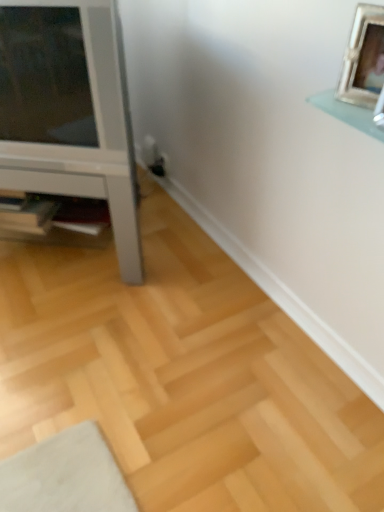
Question: Is the surface of wooden shelf at lower left in direct contact with silver metallic picture frame at upper right?

Choices:
 (A) no
 (B) yes

Answer: (A)

Question: Is wooden shelf at lower left turned away from silver metallic picture frame at upper right?

Choices:
 (A) yes
 (B) no

Answer: (B)

Question: Considering the relative sizes of wooden shelf at lower left and silver metallic picture frame at upper right in the image provided, is wooden shelf at lower left bigger than silver metallic picture frame at upper right?

Choices:
 (A) no
 (B) yes

Answer: (B)

Question: Can you confirm if wooden shelf at lower left is shorter than silver metallic picture frame at upper right?

Choices:
 (A) no
 (B) yes

Answer: (B)

Question: From the image's perspective, is wooden shelf at lower left above silver metallic picture frame at upper right?

Choices:
 (A) no
 (B) yes

Answer: (A)

Question: In terms of height, does wooden shelf at lower left look taller or shorter compared to silver metallic picture frame at upper right?

Choices:
 (A) tall
 (B) short

Answer: (B)

Question: Looking at the image, does wooden shelf at lower left seem bigger or smaller compared to silver metallic picture frame at upper right?

Choices:
 (A) small
 (B) big

Answer: (B)

Question: Considering the relative positions of wooden shelf at lower left and silver metallic picture frame at upper right in the image provided, is wooden shelf at lower left to the left or to the right of silver metallic picture frame at upper right?

Choices:
 (A) right
 (B) left

Answer: (B)

Question: Choose the correct answer: Is wooden shelf at lower left inside silver metallic picture frame at upper right or outside it?

Choices:
 (A) inside
 (B) outside

Answer: (B)

Question: Is white glossy tv stand at left taller or shorter than wooden shelf at lower left?

Choices:
 (A) short
 (B) tall

Answer: (B)

Question: Considering their positions, is white glossy tv stand at left located in front of or behind wooden shelf at lower left?

Choices:
 (A) behind
 (B) front

Answer: (B)

Question: From the image's perspective, is white glossy tv stand at left positioned above or below wooden shelf at lower left?

Choices:
 (A) above
 (B) below

Answer: (A)

Question: From a real-world perspective, is white glossy tv stand at left positioned above or below wooden shelf at lower left?

Choices:
 (A) below
 (B) above

Answer: (B)

Question: Would you say wooden shelf at lower left is inside or outside white glossy tv stand at left?

Choices:
 (A) outside
 (B) inside

Answer: (B)

Question: Is wooden shelf at lower left wider or thinner than white glossy tv stand at left?

Choices:
 (A) thin
 (B) wide

Answer: (A)